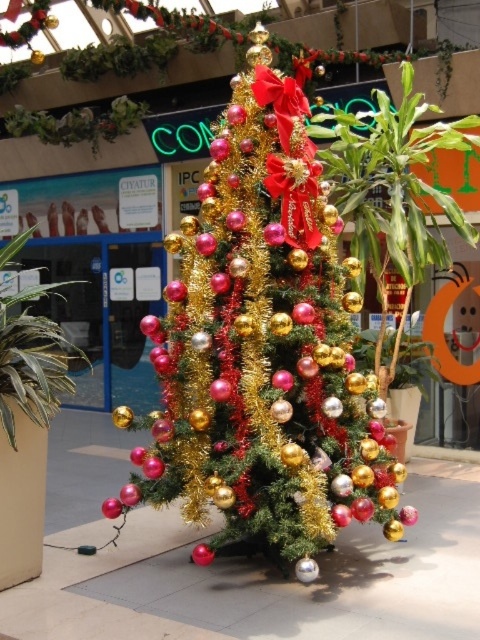
Question: Among these objects, which one is nearest to the camera?

Choices:
 (A) shiny metallic christmas tree at center
 (B) green leafy plant at left

Answer: (B)

Question: Does shiny metallic christmas tree at center lie in front of green leafy plant at left?

Choices:
 (A) no
 (B) yes

Answer: (A)

Question: Does shiny metallic christmas tree at center appear under green leafy plant at left?

Choices:
 (A) no
 (B) yes

Answer: (A)

Question: Considering the relative positions of shiny metallic christmas tree at center and green leafy plant at left in the image provided, where is shiny metallic christmas tree at center located with respect to green leafy plant at left?

Choices:
 (A) above
 (B) below

Answer: (A)

Question: Which of the following is the closest to the observer?

Choices:
 (A) shiny metallic christmas tree at center
 (B) green leafy plant at left

Answer: (B)